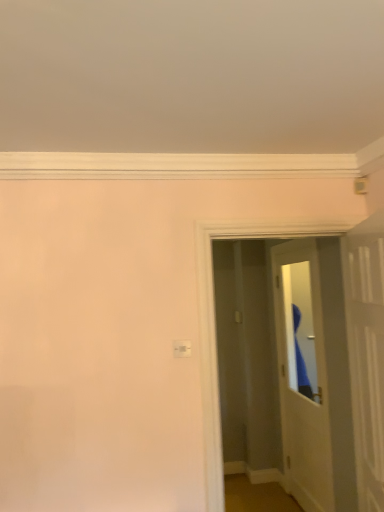
Find the location of a particular element. white glossy door at upper right, the 1th door viewed from the front is located at coordinates (366, 353).

The width and height of the screenshot is (384, 512). What do you see at coordinates (366, 353) in the screenshot? I see `white glossy door at upper right, the 1th door viewed from the front` at bounding box center [366, 353].

Measure the distance between white glossy door at center, positioned as the first door in back-to-front order, and camera.

white glossy door at center, positioned as the first door in back-to-front order, is 8.74 feet from camera.

This screenshot has height=512, width=384. What are the coordinates of `white glossy door at center, acting as the 2th door starting from the front` in the screenshot? It's located at (301, 374).

The height and width of the screenshot is (512, 384). What do you see at coordinates (301, 374) in the screenshot?
I see `white glossy door at center, acting as the 2th door starting from the front` at bounding box center [301, 374].

Where is `white glossy door at upper right, which is the 2th door in back-to-front order`? The height and width of the screenshot is (512, 384). white glossy door at upper right, which is the 2th door in back-to-front order is located at coordinates (366, 353).

Which is more to the right, white glossy door at upper right, the 1th door viewed from the front, or white glossy door at center, acting as the 2th door starting from the front?

From the viewer's perspective, white glossy door at center, acting as the 2th door starting from the front, appears more on the right side.

Which is behind, white glossy door at upper right, the 1th door viewed from the front, or white glossy door at center, positioned as the first door in back-to-front order?

white glossy door at center, positioned as the first door in back-to-front order, is further from the camera.

Considering the points (382, 510) and (321, 400), which point is behind, point (382, 510) or point (321, 400)?

Positioned behind is point (321, 400).

From the image's perspective, which object appears higher, white glossy door at upper right, the 1th door viewed from the front, or white glossy door at center, acting as the 2th door starting from the front?

white glossy door at upper right, the 1th door viewed from the front, is shown above in the image.

From a real-world perspective, which object rests below the other?

From a 3D spatial view, white glossy door at center, positioned as the first door in back-to-front order, is below.

Can you confirm if white glossy door at upper right, which is the 2th door in back-to-front order, is wider than white glossy door at center, positioned as the first door in back-to-front order?

Correct, the width of white glossy door at upper right, which is the 2th door in back-to-front order, exceeds that of white glossy door at center, positioned as the first door in back-to-front order.

Considering the sizes of objects white glossy door at upper right, the 1th door viewed from the front, and white glossy door at center, positioned as the first door in back-to-front order, in the image provided, who is shorter, white glossy door at upper right, the 1th door viewed from the front, or white glossy door at center, positioned as the first door in back-to-front order,?

Standing shorter between the two is white glossy door at upper right, the 1th door viewed from the front.

Is white glossy door at upper right, the 1th door viewed from the front, bigger or smaller than white glossy door at center, positioned as the first door in back-to-front order?

In the image, white glossy door at upper right, the 1th door viewed from the front, appears to be smaller than white glossy door at center, positioned as the first door in back-to-front order.

Is white glossy door at upper right, the 1th door viewed from the front, not inside white glossy door at center, positioned as the first door in back-to-front order?

Yes.

Is white glossy door at upper right, which is the 2th door in back-to-front order, next to white glossy door at center, positioned as the first door in back-to-front order?

There is a gap between white glossy door at upper right, which is the 2th door in back-to-front order, and white glossy door at center, positioned as the first door in back-to-front order.

Is white glossy door at upper right, which is the 2th door in back-to-front order, looking in the opposite direction of white glossy door at center, positioned as the first door in back-to-front order?

white glossy door at upper right, which is the 2th door in back-to-front order, does not have its back to white glossy door at center, positioned as the first door in back-to-front order.

What's the angular difference between white glossy door at upper right, the 1th door viewed from the front, and white glossy door at center, positioned as the first door in back-to-front order,'s facing directions?

The facing directions of white glossy door at upper right, the 1th door viewed from the front, and white glossy door at center, positioned as the first door in back-to-front order, are 16.1 degrees apart.

Could you measure the distance between white glossy door at upper right, which is the 2th door in back-to-front order, and white glossy door at center, positioned as the first door in back-to-front order?

white glossy door at upper right, which is the 2th door in back-to-front order, is 3.59 feet from white glossy door at center, positioned as the first door in back-to-front order.

The width and height of the screenshot is (384, 512). In order to click on door located above the white glossy door at center, positioned as the first door in back-to-front order (from a real-world perspective) in this screenshot , I will do `click(366, 353)`.

Considering the relative positions of white glossy door at center, acting as the 2th door starting from the front, and white glossy door at upper right, which is the 2th door in back-to-front order, in the image provided, is white glossy door at center, acting as the 2th door starting from the front, to the left of white glossy door at upper right, which is the 2th door in back-to-front order, from the viewer's perspective?

No, white glossy door at center, acting as the 2th door starting from the front, is not to the left of white glossy door at upper right, which is the 2th door in back-to-front order.

Between white glossy door at center, positioned as the first door in back-to-front order, and white glossy door at upper right, the 1th door viewed from the front, which one is positioned in front?

white glossy door at upper right, the 1th door viewed from the front, is in front.

Is point (299, 334) positioned before point (373, 423)?

No, it is not.

From the image's perspective, which object appears higher, white glossy door at center, positioned as the first door in back-to-front order, or white glossy door at upper right, which is the 2th door in back-to-front order?

white glossy door at upper right, which is the 2th door in back-to-front order, from the image's perspective.

From a real-world perspective, is white glossy door at center, positioned as the first door in back-to-front order, physically above white glossy door at upper right, which is the 2th door in back-to-front order?

No, from a real-world perspective, white glossy door at center, positioned as the first door in back-to-front order, is not on top of white glossy door at upper right, which is the 2th door in back-to-front order.

Which object is thinner, white glossy door at center, acting as the 2th door starting from the front, or white glossy door at upper right, which is the 2th door in back-to-front order?

white glossy door at center, acting as the 2th door starting from the front.

Which of these two, white glossy door at center, positioned as the first door in back-to-front order, or white glossy door at upper right, which is the 2th door in back-to-front order, stands taller?

With more height is white glossy door at center, positioned as the first door in back-to-front order.

Considering the relative sizes of white glossy door at center, positioned as the first door in back-to-front order, and white glossy door at upper right, the 1th door viewed from the front, in the image provided, is white glossy door at center, positioned as the first door in back-to-front order, bigger than white glossy door at upper right, the 1th door viewed from the front,?

Correct, white glossy door at center, positioned as the first door in back-to-front order, is larger in size than white glossy door at upper right, the 1th door viewed from the front.

Choose the correct answer: Is white glossy door at center, positioned as the first door in back-to-front order, inside white glossy door at upper right, which is the 2th door in back-to-front order, or outside it?

white glossy door at center, positioned as the first door in back-to-front order, is located beyond the bounds of white glossy door at upper right, which is the 2th door in back-to-front order.

Is white glossy door at center, positioned as the first door in back-to-front order, directly adjacent to white glossy door at upper right, the 1th door viewed from the front?

white glossy door at center, positioned as the first door in back-to-front order, and white glossy door at upper right, the 1th door viewed from the front, are not in contact.

Could you tell me if white glossy door at center, acting as the 2th door starting from the front, is turned towards white glossy door at upper right, which is the 2th door in back-to-front order?

No, white glossy door at center, acting as the 2th door starting from the front, is not oriented towards white glossy door at upper right, which is the 2th door in back-to-front order.

Locate an element on the screen. Image resolution: width=384 pixels, height=512 pixels. door in front of the white glossy door at center, positioned as the first door in back-to-front order is located at coordinates click(x=366, y=353).

Where is `door below the white glossy door at upper right, the 1th door viewed from the front (from the image's perspective)`? door below the white glossy door at upper right, the 1th door viewed from the front (from the image's perspective) is located at coordinates (301, 374).

I want to click on door behind the white glossy door at upper right, the 1th door viewed from the front, so click(x=301, y=374).